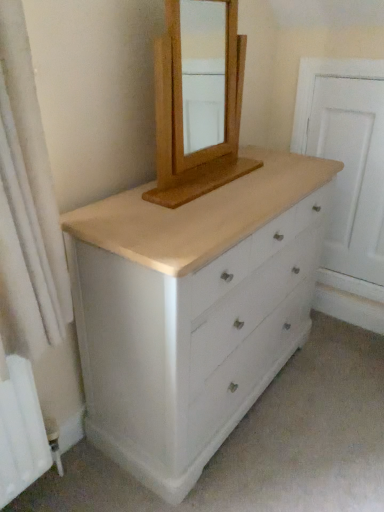
Question: From the image's perspective, relative to natural wood mirror at upper center, is white painted wood chest of drawers at center above or below?

Choices:
 (A) below
 (B) above

Answer: (A)

Question: Is white painted wood chest of drawers at center to the left or to the right of natural wood mirror at upper center in the image?

Choices:
 (A) left
 (B) right

Answer: (B)

Question: Which is nearer to the white wood screen door at right?

Choices:
 (A) white fabric shower curtain at left
 (B) white painted wood chest of drawers at center
 (C) natural wood mirror at upper center

Answer: (C)

Question: Based on their relative distances, which object is nearer to the white wood screen door at right?

Choices:
 (A) white painted wood chest of drawers at center
 (B) natural wood mirror at upper center
 (C) white fabric shower curtain at left

Answer: (B)